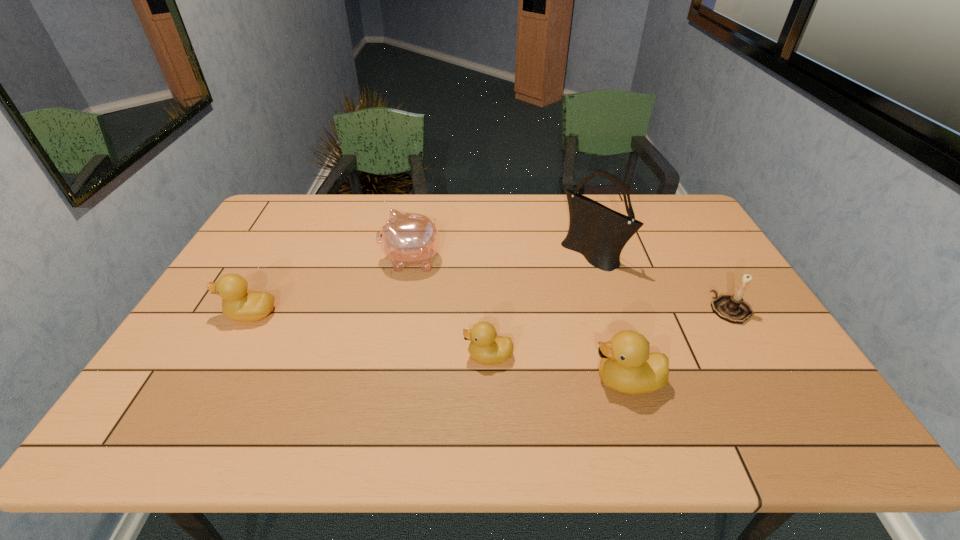
You are a GUI agent. You are given a task and a screenshot of the screen. Output one action in this format:
    pyautogui.click(x=<x>, y=<y>)
    Task: Click on the object that is at the left edge
    This screenshot has height=540, width=960.
    Given the screenshot: What is the action you would take?
    pyautogui.click(x=242, y=305)

Identify the location of object located in the right edge section of the desktop. Image resolution: width=960 pixels, height=540 pixels. (733, 308).

You are a GUI agent. You are given a task and a screenshot of the screen. Output one action in this format:
    pyautogui.click(x=<x>, y=<y>)
    Task: Click on the vacant space at the far edge of the desktop
    Image resolution: width=960 pixels, height=540 pixels.
    Given the screenshot: What is the action you would take?
    pyautogui.click(x=545, y=198)

I want to click on vacant space at the near edge of the desktop, so click(292, 373).

I want to click on free space at the left edge of the desktop, so click(x=249, y=247).

At what (x,y) coordinates should I click in order to perform the action: click on free region at the right edge of the desktop. Please return your answer as a coordinate pair (x, y). The image size is (960, 540). Looking at the image, I should click on (733, 351).

Find the location of a particular element. This screenshot has width=960, height=540. free space at the far left corner of the desktop is located at coordinates (300, 197).

What are the coordinates of `vacant space at the near left corner of the desktop` in the screenshot? It's located at (217, 391).

This screenshot has height=540, width=960. In order to click on free spot between the shoulder bag and the second object from left to right in this screenshot , I will do `click(502, 257)`.

Where is `free space between the candle holder and the second shortest duckling`? free space between the candle holder and the second shortest duckling is located at coordinates (491, 312).